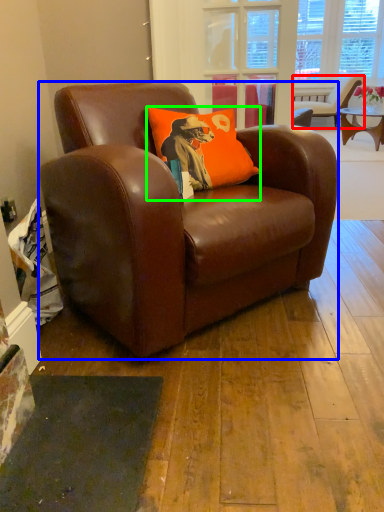
Question: Considering the real-world distances, which object is closest to chair (highlighted by a red box)? chair (highlighted by a blue box) or pillow (highlighted by a green box).

Choices:
 (A) chair
 (B) pillow

Answer: (B)